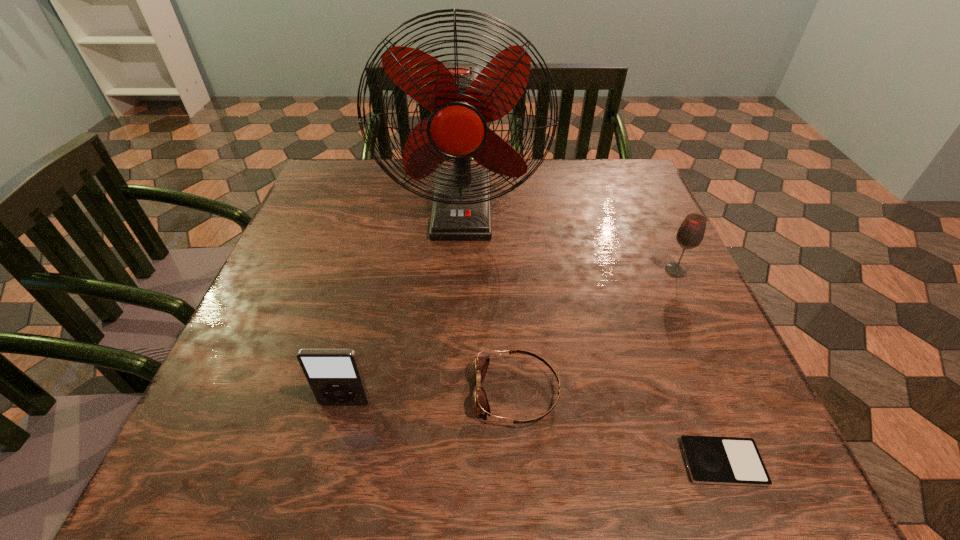
The width and height of the screenshot is (960, 540). In order to click on free spot that satisfies the following two spatial constraints: 1. on the front-facing side of the shortest object; 2. on the left side of the left iPod in this screenshot , I will do `click(330, 462)`.

The height and width of the screenshot is (540, 960). Find the location of `blank area in the image that satisfies the following two spatial constraints: 1. through the lenses of the goggles; 2. on the front-facing side of the farther iPod`. blank area in the image that satisfies the following two spatial constraints: 1. through the lenses of the goggles; 2. on the front-facing side of the farther iPod is located at coordinates (517, 403).

Identify the location of vacant space that satisfies the following two spatial constraints: 1. on the front-facing side of the farthest object; 2. on the right side of the right iPod. (449, 462).

The image size is (960, 540). What are the coordinates of `free space that satisfies the following two spatial constraints: 1. through the lenses of the fourth tallest object; 2. on the front-facing side of the taller iPod` in the screenshot? It's located at (517, 403).

What are the coordinates of `vacant region that satisfies the following two spatial constraints: 1. through the lenses of the nearer iPod; 2. on the right side of the fourth tallest object` in the screenshot? It's located at (521, 462).